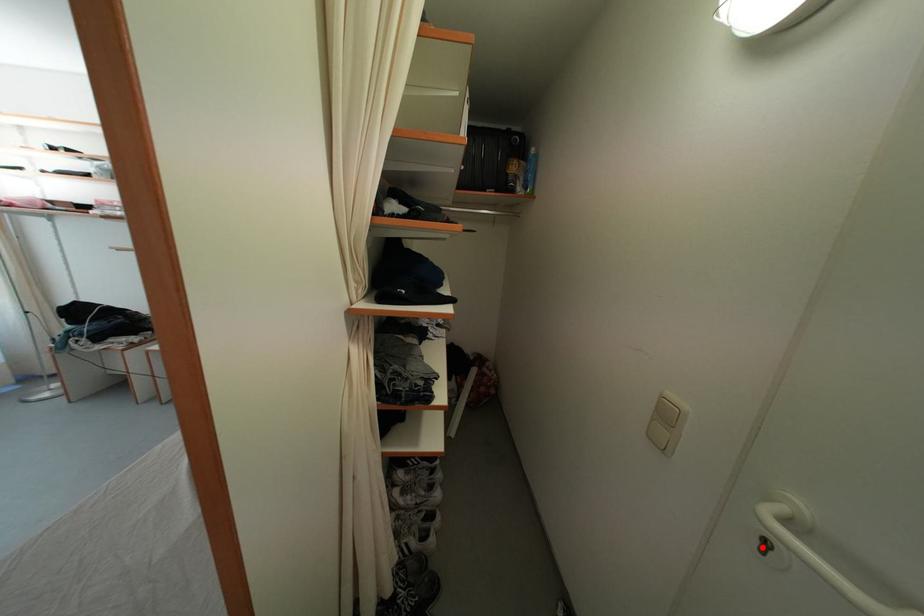
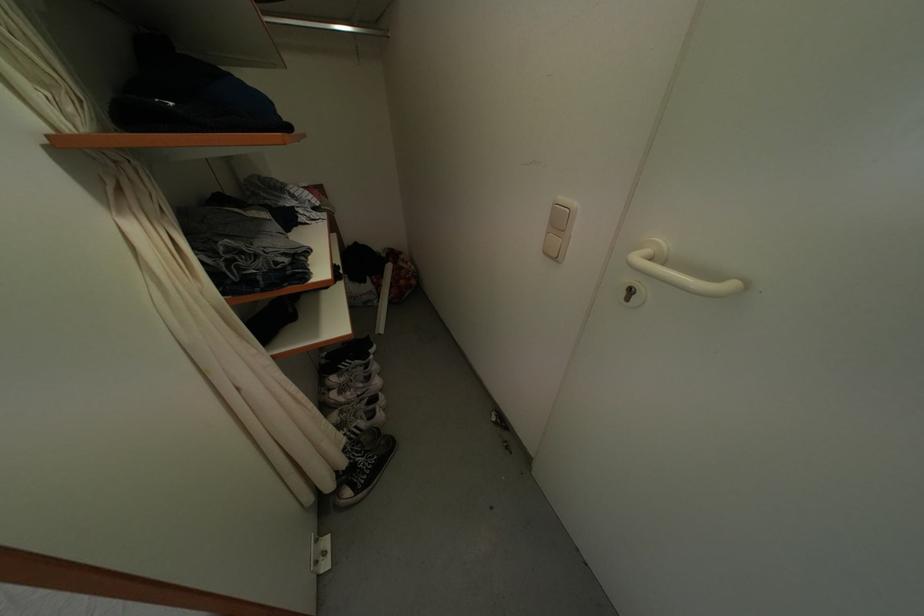
Question: I am providing you with two images of the same scene from different viewpoints. A red point is marked on the first image. Is the red point's position out of view in image 2?

Choices:
 (A) Yes
 (B) No

Answer: (B)